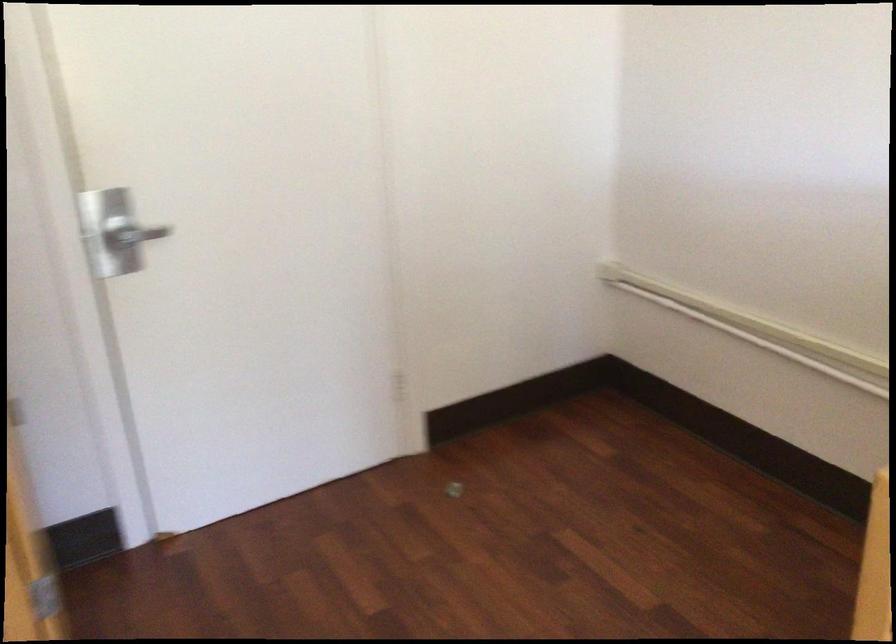
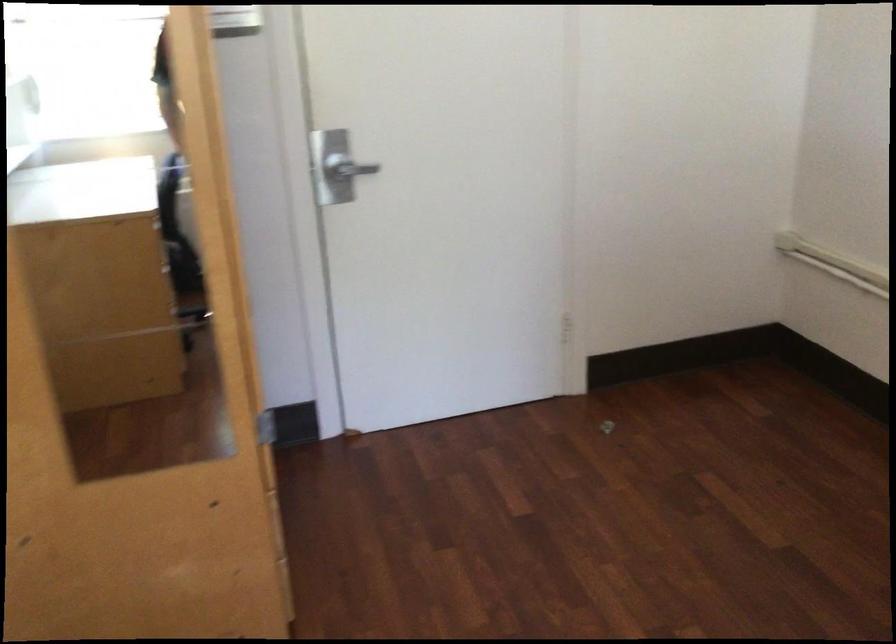
Question: The first image is from the beginning of the video and the second image is from the end. How did the camera likely rotate when shooting the video?

Choices:
 (A) Left
 (B) Right
 (C) Up
 (D) Down

Answer: (A)